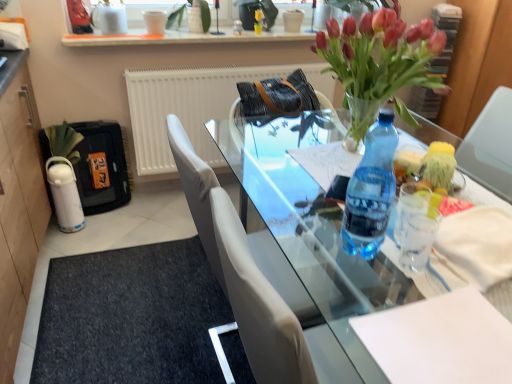
This screenshot has height=384, width=512. I want to click on vacant point above black rubber doormat at lower left (from a real-world perspective), so click(129, 307).